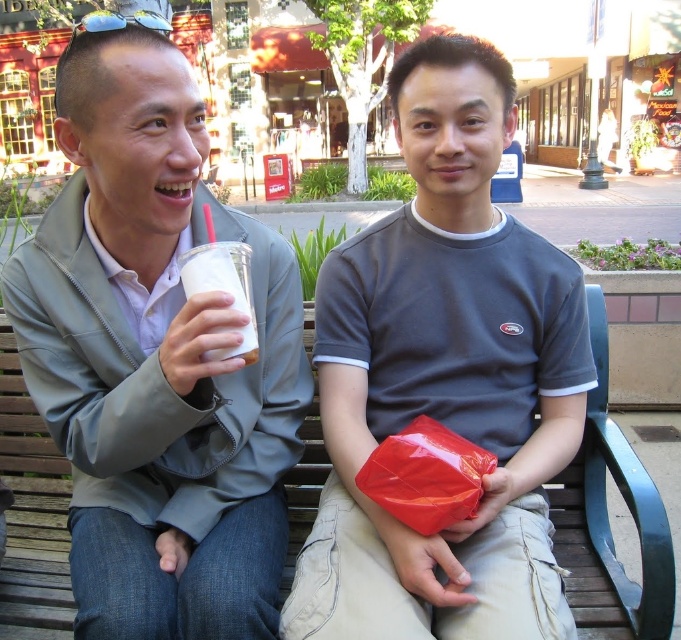
Is the position of matte gray shirt at center less distant than that of white plastic cup at left?

That is True.

Which is more to the right, matte gray shirt at center or white plastic cup at left?

matte gray shirt at center

Is point (340, 509) positioned in front of point (208, 264)?

No, (340, 509) is further to viewer.

At what (x,y) coordinates should I click in order to perform the action: click on matte gray shirt at center. Please return your answer as a coordinate pair (x, y). The height and width of the screenshot is (640, 681). Looking at the image, I should click on (445, 378).

Between matte plastic cup at left and matte gray shirt at center, which one appears on the left side from the viewer's perspective?

matte plastic cup at left

Can you confirm if matte plastic cup at left is positioned to the right of matte gray shirt at center?

Incorrect, matte plastic cup at left is not on the right side of matte gray shirt at center.

This screenshot has width=681, height=640. I want to click on matte plastic cup at left, so click(x=157, y=358).

Find the location of a particular element. matte plastic cup at left is located at coordinates (157, 358).

Does matte plastic cup at left appear over white plastic cup at left?

Actually, matte plastic cup at left is below white plastic cup at left.

Is matte plastic cup at left to the right of white plastic cup at left from the viewer's perspective?

Incorrect, matte plastic cup at left is not on the right side of white plastic cup at left.

What do you see at coordinates (157, 358) in the screenshot? I see `matte plastic cup at left` at bounding box center [157, 358].

Where is `matte plastic cup at left`? The image size is (681, 640). matte plastic cup at left is located at coordinates (157, 358).